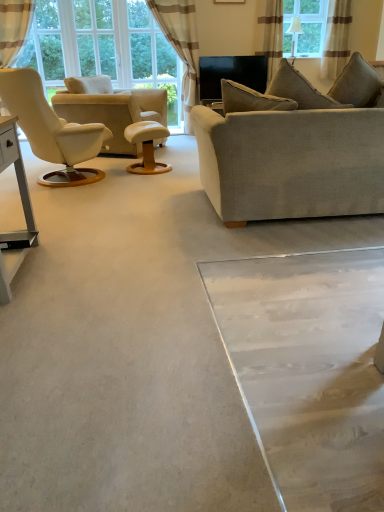
I want to click on wooden round table at center, so pos(146,146).

Identify the location of clear glass window at upper center. The height and width of the screenshot is (512, 384). (305, 27).

Describe the element at coordinates (295, 148) in the screenshot. I see `light gray fabric couch at center` at that location.

This screenshot has width=384, height=512. What are the coordinates of `beige striped curtain at upper center, which appears as the first curtain when viewed from the left` in the screenshot? It's located at [181, 45].

Locate an element on the screen. The image size is (384, 512). wooden round table at center is located at coordinates (146, 146).

Considering the relative sizes of brown striped curtain at upper right, which appears as the second curtain when viewed from the left, and textured beige pillow at upper right in the image provided, is brown striped curtain at upper right, which appears as the second curtain when viewed from the left, bigger than textured beige pillow at upper right?

Yes.

Are brown striped curtain at upper right, which appears as the second curtain when viewed from the left, and textured beige pillow at upper right far apart?

Absolutely, brown striped curtain at upper right, which appears as the second curtain when viewed from the left, is distant from textured beige pillow at upper right.

Is brown striped curtain at upper right, which appears as the second curtain when viewed from the left, facing away from textured beige pillow at upper right?

No, brown striped curtain at upper right, which appears as the second curtain when viewed from the left, is not facing away from textured beige pillow at upper right.

Considering the sizes of objects brown striped curtain at upper right, which appears as the second curtain when viewed from the left, and textured beige pillow at upper right in the image provided, who is shorter, brown striped curtain at upper right, which appears as the second curtain when viewed from the left, or textured beige pillow at upper right?

textured beige pillow at upper right.

Can we say transparent glass door at upper center lies outside beige striped curtain at upper center, placed as the third curtain when sorted from right to left?

Yes, transparent glass door at upper center is located beyond the bounds of beige striped curtain at upper center, placed as the third curtain when sorted from right to left.

Is transparent glass door at upper center taller or shorter than beige striped curtain at upper center, placed as the third curtain when sorted from right to left?

transparent glass door at upper center is shorter than beige striped curtain at upper center, placed as the third curtain when sorted from right to left.

Which is more to the right, transparent glass door at upper center or beige striped curtain at upper center, placed as the third curtain when sorted from right to left?

beige striped curtain at upper center, placed as the third curtain when sorted from right to left.

Is transparent glass door at upper center oriented away from beige striped curtain at upper center, placed as the third curtain when sorted from right to left?

No.

You are a GUI agent. You are given a task and a screenshot of the screen. Output one action in this format:
    pyautogui.click(x=<x>, y=<y>)
    Task: Click on the studio couch below the brown striped curtain at upper right, which is the first curtain in right-to-left order (from the image's perspective)
    
    Given the screenshot: What is the action you would take?
    pyautogui.click(x=295, y=148)

Which of these two, brown striped curtain at upper right, the third curtain viewed from the left, or light gray fabric couch at center, is bigger?

Bigger between the two is light gray fabric couch at center.

Is brown striped curtain at upper right, which is the first curtain in right-to-left order, looking in the opposite direction of light gray fabric couch at center?

No.

Looking at this image, is brown striped curtain at upper right, the third curtain viewed from the left, to the left or to the right of light gray fabric couch at center in the image?

From the image, it's evident that brown striped curtain at upper right, the third curtain viewed from the left, is to the right of light gray fabric couch at center.

From the image's perspective, does textured beige pillow at upper right appear lower than transparent glass door at upper center?

Yes, from the image's perspective, textured beige pillow at upper right is below transparent glass door at upper center.

Can you see textured beige pillow at upper right touching transparent glass door at upper center?

No, textured beige pillow at upper right is not making contact with transparent glass door at upper center.

Measure the distance between textured beige pillow at upper right and transparent glass door at upper center.

textured beige pillow at upper right and transparent glass door at upper center are 4.62 meters apart.

Considering the sizes of objects textured beige pillow at upper right and transparent glass door at upper center in the image provided, who is bigger, textured beige pillow at upper right or transparent glass door at upper center?

Bigger between the two is textured beige pillow at upper right.

Considering the relative sizes of clear glass window at upper center and transparent glass door at upper center in the image provided, is clear glass window at upper center smaller than transparent glass door at upper center?

Correct, clear glass window at upper center occupies less space than transparent glass door at upper center.

Which object is positioned more to the right, clear glass window at upper center or transparent glass door at upper center?

clear glass window at upper center is more to the right.

Is clear glass window at upper center shorter than transparent glass door at upper center?

Indeed, clear glass window at upper center has a lesser height compared to transparent glass door at upper center.

Considering the sizes of objects clear glass window at upper center and transparent glass door at upper center in the image provided, who is thinner, clear glass window at upper center or transparent glass door at upper center?

transparent glass door at upper center is thinner.

At what (x,y) coordinates should I click in order to perform the action: click on the 2nd curtain counting from the right side of the wooden round table at center. Please return your answer as a coordinate pair (x, y). Image resolution: width=384 pixels, height=512 pixels. Looking at the image, I should click on (272, 35).

From a real-world perspective, relative to wooden round table at center, is brown striped curtain at upper right, the second curtain viewed from the right, vertically above or below?

brown striped curtain at upper right, the second curtain viewed from the right, is above wooden round table at center.

Would you consider brown striped curtain at upper right, which appears as the second curtain when viewed from the left, to be distant from wooden round table at center?

Indeed, brown striped curtain at upper right, which appears as the second curtain when viewed from the left, is not near wooden round table at center.

From a real-world perspective, is beige leather chair at left located higher than white wood table at left?

Yes, from a real-world perspective, beige leather chair at left is over white wood table at left

Is beige leather chair at left not near white wood table at left?

Yes.

Can you confirm if beige leather chair at left is shorter than white wood table at left?

No.

Considering the points (112, 149) and (5, 239), which point is in front, point (112, 149) or point (5, 239)?

The point (5, 239) is in front.

Locate an element on the screen. curtain that is the 2nd object located behind the textured beige pillow at upper right is located at coordinates (272, 35).

This screenshot has height=512, width=384. I want to click on the 2nd curtain below the transparent glass door at upper center (from a real-world perspective), so click(181, 45).

Looking at the image, which one is located further to transparent glass door at upper center, beige striped curtain at upper center, which appears as the first curtain when viewed from the left, or white wood table at left?

white wood table at left.

Based on their spatial positions, is white wood table at left or brown striped curtain at upper right, the third curtain viewed from the left, further from clear glass window at upper center?

The object further to clear glass window at upper center is white wood table at left.

Estimate the real-world distances between objects in this image. Which object is closer to brown striped curtain at upper right, the second curtain viewed from the right, white wood table at left or clear glass window at upper center?

Based on the image, clear glass window at upper center appears to be nearer to brown striped curtain at upper right, the second curtain viewed from the right.

Looking at the image, which one is located closer to wooden round table at center, transparent glass door at upper center or brown striped curtain at upper right, the second curtain viewed from the right?

The object closer to wooden round table at center is transparent glass door at upper center.

In the scene shown: When comparing their distances from brown striped curtain at upper right, which is the first curtain in right-to-left order, does brown striped curtain at upper right, which appears as the second curtain when viewed from the left, or clear glass window at upper center seem further?

brown striped curtain at upper right, which appears as the second curtain when viewed from the left, is positioned further to the anchor brown striped curtain at upper right, which is the first curtain in right-to-left order.

When comparing their distances from wooden round table at center, does textured beige pillow at upper right or beige striped curtain at upper center, placed as the third curtain when sorted from right to left, seem further?

Based on the image, textured beige pillow at upper right appears to be further to wooden round table at center.

Looking at the image, which one is located further to light gray fabric couch at center, textured beige pillow at upper right or transparent glass door at upper center?

transparent glass door at upper center.

Considering their positions, is wooden round table at center positioned further to white wood table at left than brown striped curtain at upper right, which appears as the second curtain when viewed from the left?

Based on the image, brown striped curtain at upper right, which appears as the second curtain when viewed from the left, appears to be further to white wood table at left.

Locate an element on the screen. The width and height of the screenshot is (384, 512). chair positioned between textured beige pillow at upper right and brown striped curtain at upper right, the second curtain viewed from the right, from near to far is located at coordinates (110, 109).

At what (x,y) coordinates should I click in order to perform the action: click on chair between transparent glass door at upper center and brown striped curtain at upper right, the third curtain viewed from the left, in the horizontal direction. Please return your answer as a coordinate pair (x, y). This screenshot has height=512, width=384. Looking at the image, I should click on (110, 109).

The height and width of the screenshot is (512, 384). In order to click on round table situated between transparent glass door at upper center and brown striped curtain at upper right, which appears as the second curtain when viewed from the left, from left to right in this screenshot , I will do coord(146,146).

This screenshot has width=384, height=512. Identify the location of round table between beige leather chair at left and clear glass window at upper center in the horizontal direction. (146, 146).